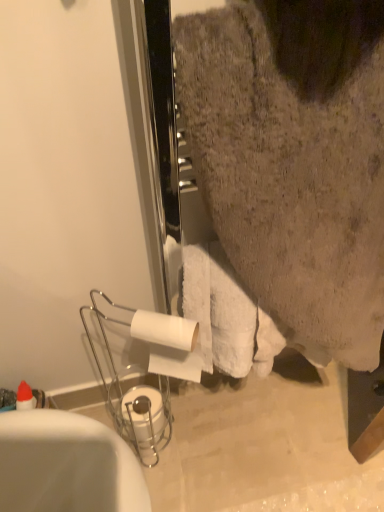
Find the location of a particular element. The height and width of the screenshot is (512, 384). free space above white glossy bathtub at lower left (from a real-world perspective) is located at coordinates (61, 461).